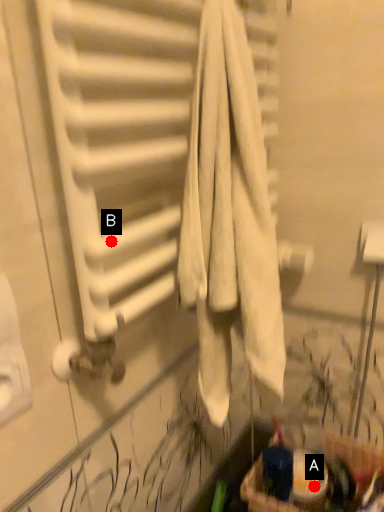
Question: Two points are circled on the image, labeled by A and B beside each circle. Which point is closer to the camera?

Choices:
 (A) A is closer
 (B) B is closer

Answer: (B)